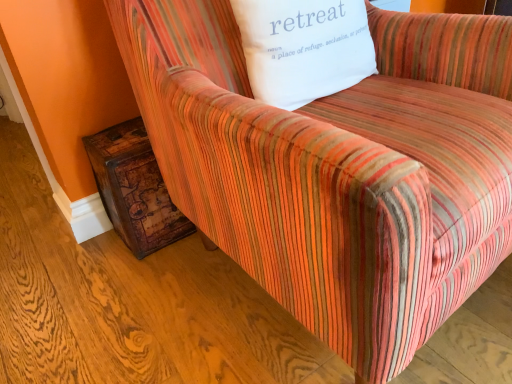
Image resolution: width=512 pixels, height=384 pixels. Identify the location of rustic wood side table at lower left. (134, 189).

In order to face rustic wood side table at lower left, should I rotate leftwards or rightwards?

A 16.852 degree turn to the left will do.

What do you see at coordinates (134, 189) in the screenshot? I see `rustic wood side table at lower left` at bounding box center [134, 189].

The width and height of the screenshot is (512, 384). What do you see at coordinates (304, 48) in the screenshot?
I see `white cotton pillow at upper center` at bounding box center [304, 48].

This screenshot has width=512, height=384. Find the location of `white cotton pillow at upper center`. white cotton pillow at upper center is located at coordinates (304, 48).

The image size is (512, 384). Identify the location of rustic wood side table at lower left. (134, 189).

Does rustic wood side table at lower left appear on the left side of white cotton pillow at upper center?

Indeed, rustic wood side table at lower left is positioned on the left side of white cotton pillow at upper center.

Which object is further away from the camera taking this photo, rustic wood side table at lower left or white cotton pillow at upper center?

rustic wood side table at lower left.

Between point (169, 235) and point (261, 99), which one is positioned behind?

The point (169, 235) is behind.

From the image's perspective, which is above, rustic wood side table at lower left or white cotton pillow at upper center?

white cotton pillow at upper center is shown above in the image.

From a real-world perspective, is rustic wood side table at lower left positioned above or below white cotton pillow at upper center?

Clearly, from a real-world perspective, rustic wood side table at lower left is below white cotton pillow at upper center.

Between rustic wood side table at lower left and white cotton pillow at upper center, which one has smaller width?

white cotton pillow at upper center is thinner.

In terms of height, does rustic wood side table at lower left look taller or shorter compared to white cotton pillow at upper center?

Clearly, rustic wood side table at lower left is taller compared to white cotton pillow at upper center.

Considering the sizes of objects rustic wood side table at lower left and white cotton pillow at upper center in the image provided, who is smaller, rustic wood side table at lower left or white cotton pillow at upper center?

Smaller between the two is rustic wood side table at lower left.

Is white cotton pillow at upper center a part of rustic wood side table at lower left?

No, white cotton pillow at upper center is located outside of rustic wood side table at lower left.

Is there a large distance between rustic wood side table at lower left and white cotton pillow at upper center?

rustic wood side table at lower left is actually quite close to white cotton pillow at upper center.

Is rustic wood side table at lower left facing away from white cotton pillow at upper center?

No, rustic wood side table at lower left is not facing away from white cotton pillow at upper center.

How different are the orientations of rustic wood side table at lower left and white cotton pillow at upper center in degrees?

rustic wood side table at lower left and white cotton pillow at upper center are facing 3.89 degrees away from each other.

Measure the distance from rustic wood side table at lower left to white cotton pillow at upper center.

19.24 inches.

This screenshot has height=384, width=512. In the image, there is a rustic wood side table at lower left. In order to click on pillow above it (from the image's perspective) in this screenshot , I will do `click(304, 48)`.

Considering the relative positions of white cotton pillow at upper center and rustic wood side table at lower left in the image provided, is white cotton pillow at upper center to the left of rustic wood side table at lower left from the viewer's perspective?

No, white cotton pillow at upper center is not to the left of rustic wood side table at lower left.

Is white cotton pillow at upper center in front of or behind rustic wood side table at lower left in the image?

In the image, white cotton pillow at upper center appears in front of rustic wood side table at lower left.

Considering the points (372, 61) and (133, 229), which point is behind, point (372, 61) or point (133, 229)?

The point (133, 229) is farther.

From the image's perspective, is white cotton pillow at upper center above or below rustic wood side table at lower left?

Based on their image positions, white cotton pillow at upper center is located above rustic wood side table at lower left.

From a real-world perspective, is white cotton pillow at upper center physically located above or below rustic wood side table at lower left?

white cotton pillow at upper center is situated higher than rustic wood side table at lower left in the real world.

In terms of width, does white cotton pillow at upper center look wider or thinner when compared to rustic wood side table at lower left?

Clearly, white cotton pillow at upper center has less width compared to rustic wood side table at lower left.

Consider the image. Can you confirm if white cotton pillow at upper center is shorter than rustic wood side table at lower left?

Correct, white cotton pillow at upper center is not as tall as rustic wood side table at lower left.

Between white cotton pillow at upper center and rustic wood side table at lower left, which one has smaller size?

Smaller between the two is rustic wood side table at lower left.

Is rustic wood side table at lower left completely or partially inside white cotton pillow at upper center?

No, rustic wood side table at lower left is located outside of white cotton pillow at upper center.

Is white cotton pillow at upper center far away from rustic wood side table at lower left?

No, white cotton pillow at upper center is not far away from rustic wood side table at lower left.

Is white cotton pillow at upper center turned away from rustic wood side table at lower left?

No.

I want to click on side table behind the white cotton pillow at upper center, so click(134, 189).

Find the location of a particular element. The height and width of the screenshot is (384, 512). side table on the left side of white cotton pillow at upper center is located at coordinates tap(134, 189).

You are a GUI agent. You are given a task and a screenshot of the screen. Output one action in this format:
    pyautogui.click(x=<x>, y=<y>)
    Task: Click on the pillow located above the rustic wood side table at lower left (from a real-world perspective)
    The width and height of the screenshot is (512, 384).
    Given the screenshot: What is the action you would take?
    pyautogui.click(x=304, y=48)